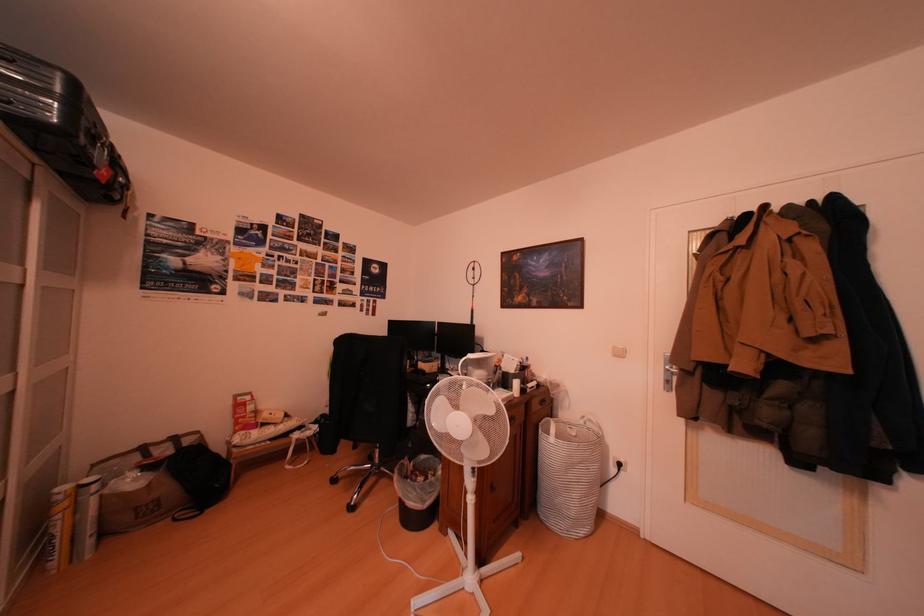
The width and height of the screenshot is (924, 616). I want to click on brown drawer knob, so click(x=542, y=400).